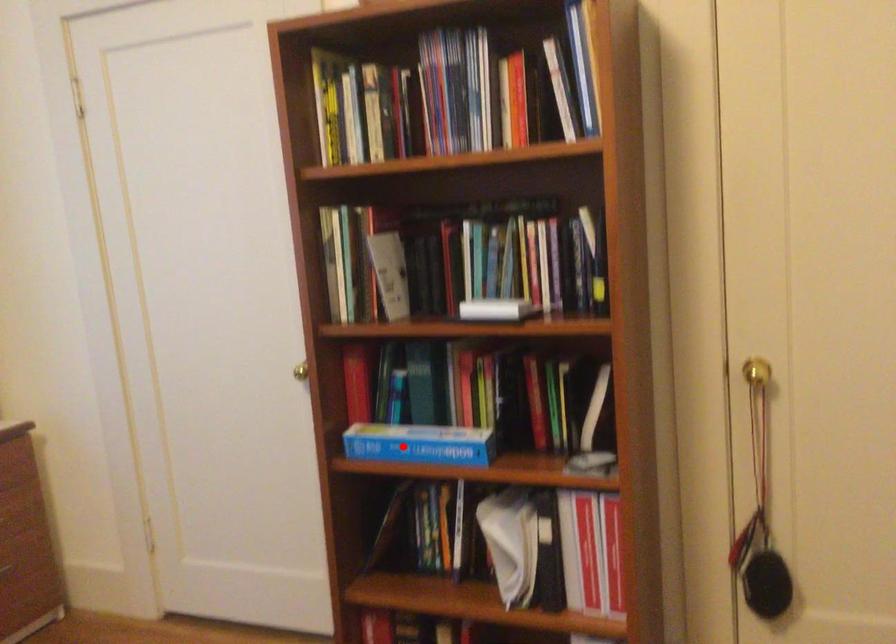
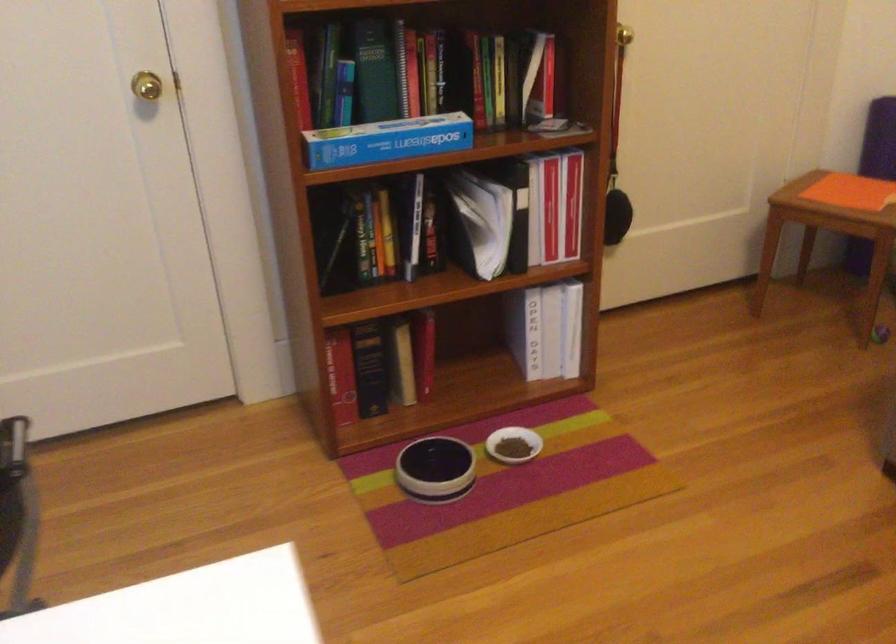
The point at the highlighted location is marked in the first image. Where is the corresponding point in the second image?

(386, 140)